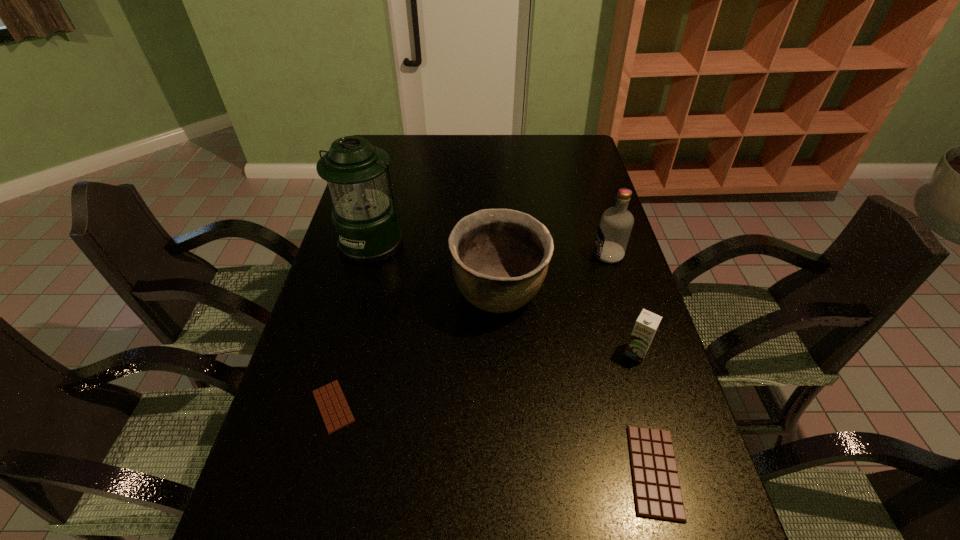
At what (x,y) coordinates should I click in order to perform the action: click on vacant space situated on the left of the taller candy bar. Please return your answer as a coordinate pair (x, y). Image resolution: width=960 pixels, height=540 pixels. Looking at the image, I should click on (542, 472).

I want to click on vacant space situated on the front of the fourth object from right to left, so click(x=503, y=389).

In order to click on vacant space located on the back of the tallest object in this screenshot , I will do (x=387, y=190).

What are the coordinates of `free spot located on the front of the third nearest object` in the screenshot? It's located at (671, 471).

Identify the location of free space located 0.320m on the label of the vodka. The width and height of the screenshot is (960, 540). (490, 255).

Where is `vacant space located on the label of the vodka`? vacant space located on the label of the vodka is located at coordinates (521, 255).

I want to click on blank space located 0.080m on the label of the vodka, so click(566, 255).

Identify the location of object that is at the near edge. Image resolution: width=960 pixels, height=540 pixels. (657, 492).

Where is `candy bar present at the left edge`? This screenshot has height=540, width=960. candy bar present at the left edge is located at coordinates (334, 409).

What are the coordinates of `lantern positioned at the left edge` in the screenshot? It's located at (365, 219).